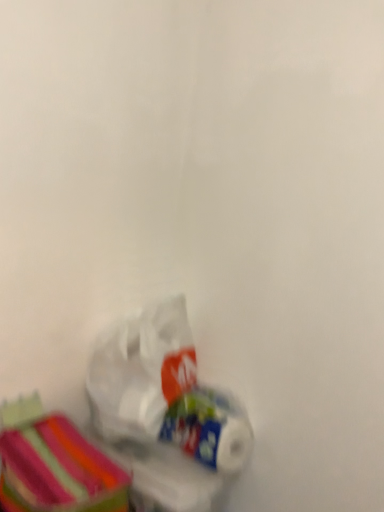
Question: From a real-world perspective, is white glossy toilet paper at lower center physically above striped fabric storage box at lower left?

Choices:
 (A) no
 (B) yes

Answer: (B)

Question: Is white glossy toilet paper at lower center facing away from striped fabric storage box at lower left?

Choices:
 (A) yes
 (B) no

Answer: (B)

Question: Does white glossy toilet paper at lower center have a larger size compared to striped fabric storage box at lower left?

Choices:
 (A) no
 (B) yes

Answer: (A)

Question: Does white glossy toilet paper at lower center have a greater width compared to striped fabric storage box at lower left?

Choices:
 (A) no
 (B) yes

Answer: (A)

Question: Could you tell me if white glossy toilet paper at lower center is facing striped fabric storage box at lower left?

Choices:
 (A) no
 (B) yes

Answer: (A)

Question: Is white glossy toilet paper at lower center thinner than striped fabric storage box at lower left?

Choices:
 (A) yes
 (B) no

Answer: (A)

Question: Can you confirm if translucent plastic bag at lower left is shorter than white glossy toilet paper at lower center?

Choices:
 (A) no
 (B) yes

Answer: (A)

Question: Is translucent plastic bag at lower left at the left side of white glossy toilet paper at lower center?

Choices:
 (A) no
 (B) yes

Answer: (B)

Question: Is white glossy toilet paper at lower center a part of translucent plastic bag at lower left?

Choices:
 (A) yes
 (B) no

Answer: (B)

Question: Considering the relative sizes of translucent plastic bag at lower left and white glossy toilet paper at lower center in the image provided, is translucent plastic bag at lower left bigger than white glossy toilet paper at lower center?

Choices:
 (A) yes
 (B) no

Answer: (A)

Question: Does translucent plastic bag at lower left lie behind white glossy toilet paper at lower center?

Choices:
 (A) yes
 (B) no

Answer: (B)

Question: Is translucent plastic bag at lower left not close to white glossy toilet paper at lower center?

Choices:
 (A) yes
 (B) no

Answer: (B)

Question: Is white glossy toilet paper at lower center further to camera compared to translucent plastic bag at lower left?

Choices:
 (A) yes
 (B) no

Answer: (A)